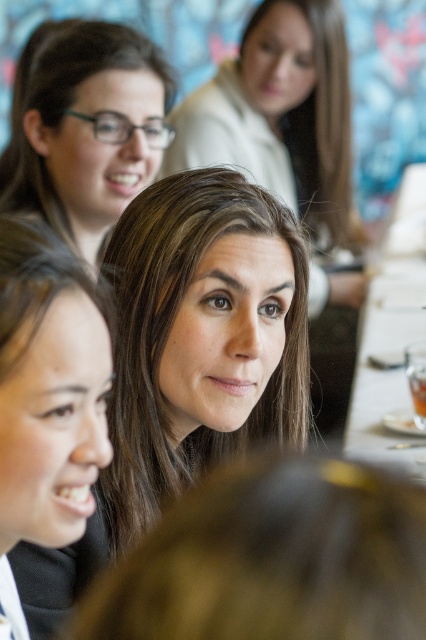
Question: Where is smooth black hair at lower left located in relation to white porcelain table at center in the image?

Choices:
 (A) left
 (B) right

Answer: (A)

Question: Which of the following is the closest to the observer?

Choices:
 (A) smooth black hair at lower left
 (B) white porcelain table at center

Answer: (A)

Question: Can you confirm if smooth black hair at lower left is bigger than white porcelain table at center?

Choices:
 (A) yes
 (B) no

Answer: (B)

Question: Which object appears closest to the camera in this image?

Choices:
 (A) white porcelain table at center
 (B) smooth black hair at lower left
 (C) matte black glasses at upper left

Answer: (B)

Question: Can you confirm if matte black glasses at upper left is positioned below white porcelain table at center?

Choices:
 (A) yes
 (B) no

Answer: (B)

Question: Which point appears closest to the camera in this image?

Choices:
 (A) (405, 336)
 (B) (51, 92)

Answer: (B)